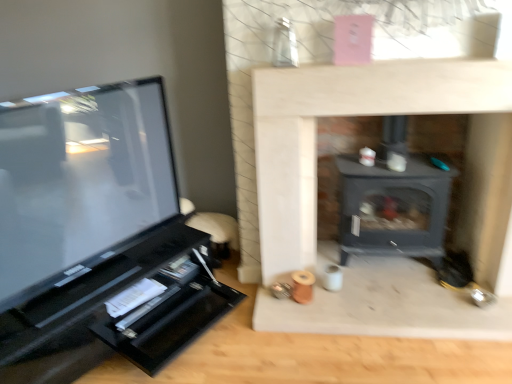
Question: Is matte black tv at left outside matte black wood burning stove at center?

Choices:
 (A) yes
 (B) no

Answer: (A)

Question: Is there a large distance between matte black tv at left and matte black wood burning stove at center?

Choices:
 (A) no
 (B) yes

Answer: (B)

Question: Is matte black tv at left to the right of matte black wood burning stove at center from the viewer's perspective?

Choices:
 (A) yes
 (B) no

Answer: (B)

Question: Is matte black tv at left smaller than matte black wood burning stove at center?

Choices:
 (A) yes
 (B) no

Answer: (B)

Question: Is matte black tv at left shorter than matte black wood burning stove at center?

Choices:
 (A) yes
 (B) no

Answer: (A)

Question: Considering the relative sizes of matte black tv at left and matte black wood burning stove at center in the image provided, is matte black tv at left wider than matte black wood burning stove at center?

Choices:
 (A) yes
 (B) no

Answer: (B)

Question: Considering the relative sizes of matte black wood burning stove at center and matte black tv at left in the image provided, is matte black wood burning stove at center shorter than matte black tv at left?

Choices:
 (A) yes
 (B) no

Answer: (B)

Question: Is matte black wood burning stove at center positioned before matte black tv at left?

Choices:
 (A) no
 (B) yes

Answer: (A)

Question: Is matte black wood burning stove at center located outside matte black tv at left?

Choices:
 (A) no
 (B) yes

Answer: (B)

Question: From the image's perspective, is matte black wood burning stove at center on top of matte black tv at left?

Choices:
 (A) no
 (B) yes

Answer: (B)

Question: Considering the relative sizes of matte black wood burning stove at center and matte black tv at left in the image provided, is matte black wood burning stove at center smaller than matte black tv at left?

Choices:
 (A) no
 (B) yes

Answer: (B)

Question: Is matte black wood burning stove at center not close to matte black tv at left?

Choices:
 (A) yes
 (B) no

Answer: (A)

Question: In the image, is matte black wood burning stove at center positioned in front of or behind matte black tv at left?

Choices:
 (A) front
 (B) behind

Answer: (B)